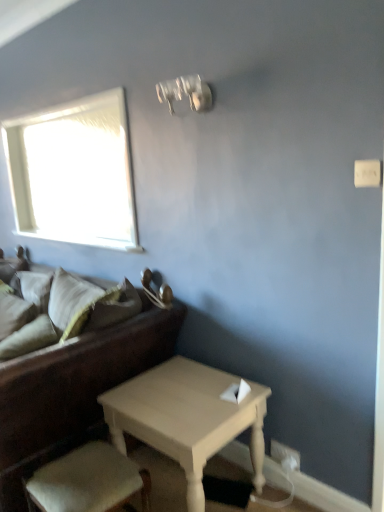
Question: Relative to light beige fabric armchair at lower left, is soft beige pillow at left, marked as the 2th pillow in a back-to-front arrangement, in front or behind?

Choices:
 (A) front
 (B) behind

Answer: (B)

Question: From a real-world perspective, is soft beige pillow at left, marked as the 2th pillow in a back-to-front arrangement, physically located above or below light beige fabric armchair at lower left?

Choices:
 (A) below
 (B) above

Answer: (B)

Question: Which object is the farthest from the light wood table at center?

Choices:
 (A) soft beige pillow at left, marked as the 2th pillow in a back-to-front arrangement
 (B) soft beige pillow at left, which appears as the first pillow when viewed from the back
 (C) dark brown leather couch at left
 (D) light beige fabric armchair at lower left

Answer: (B)

Question: Based on their relative distances, which object is farther from the soft beige pillow at left, the 1th pillow in the front-to-back sequence?

Choices:
 (A) dark brown leather couch at left
 (B) soft beige pillow at left, which appears as the first pillow when viewed from the back
 (C) light wood table at center
 (D) light beige fabric armchair at lower left

Answer: (C)